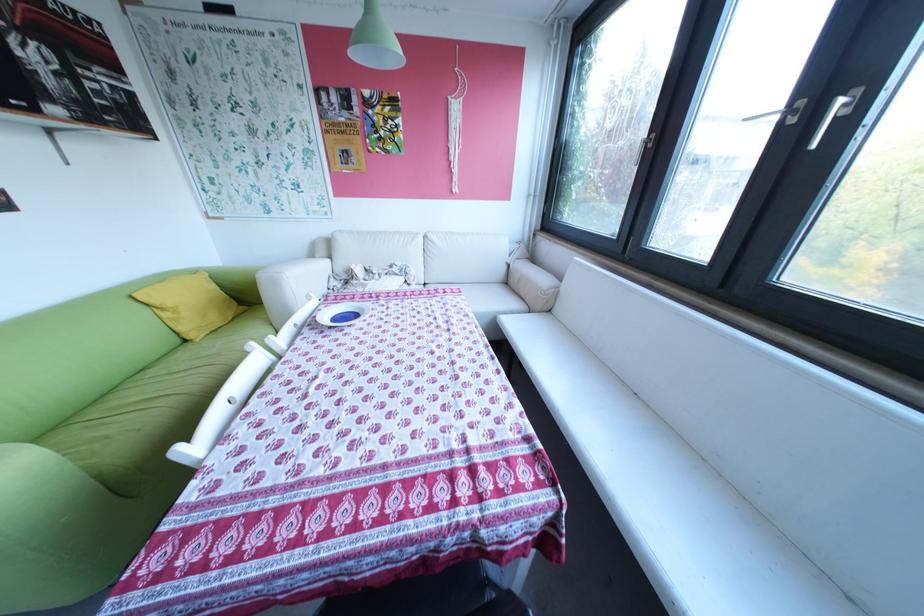
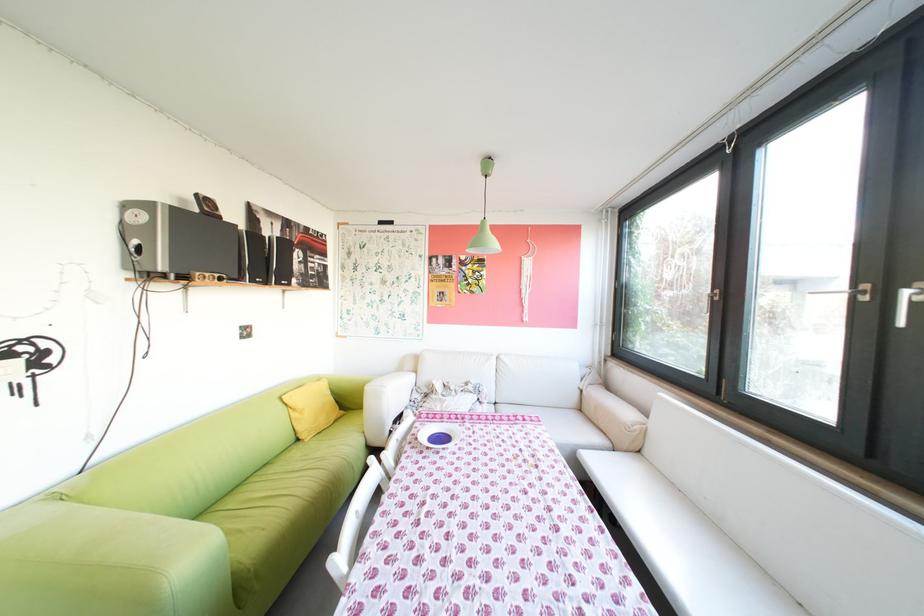
Find the pixel in the second image that matches (400,296) in the first image.

(484, 419)